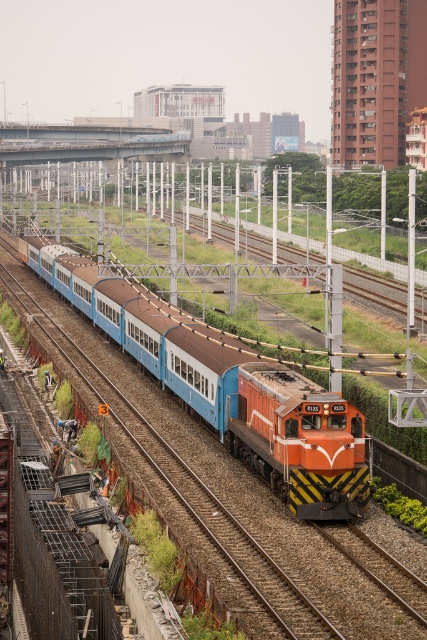
Question: Among these points, which one is nearest to the camera?

Choices:
 (A) (321, 468)
 (B) (341, 413)

Answer: (A)

Question: Does orange glossy locomotive at center appear under orange metallic locomotive at center?

Choices:
 (A) no
 (B) yes

Answer: (A)

Question: Among these objects, which one is farthest from the camera?

Choices:
 (A) orange metallic locomotive at center
 (B) orange glossy locomotive at center

Answer: (B)

Question: Considering the relative positions of orange glossy locomotive at center and orange metallic locomotive at center in the image provided, where is orange glossy locomotive at center located with respect to orange metallic locomotive at center?

Choices:
 (A) left
 (B) right

Answer: (A)

Question: Which of the following is the closest to the observer?

Choices:
 (A) (286, 369)
 (B) (336, 426)

Answer: (B)

Question: Considering the relative positions of orange glossy locomotive at center and orange metallic locomotive at center in the image provided, where is orange glossy locomotive at center located with respect to orange metallic locomotive at center?

Choices:
 (A) below
 (B) above

Answer: (B)